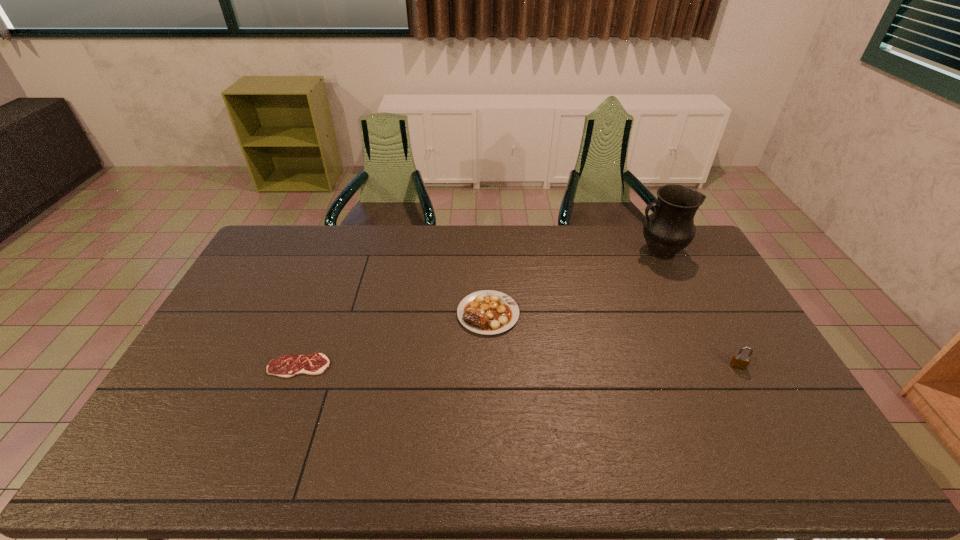
Locate an element on the screen. Image resolution: width=960 pixels, height=540 pixels. object that is the third closest to the leftmost object is located at coordinates (739, 361).

Identify which object is the closest to the second farthest object. Please provide its 2D coordinates. Your answer should be formatted as a tuple, i.e. [(x, y)], where the tuple contains the x and y coordinates of a point satisfying the conditions above.

[(286, 366)]

Find the location of a particular element. free space in the image that satisfies the following two spatial constraints: 1. on the handle side of the pitcher; 2. on the front side of the second farthest object is located at coordinates (690, 314).

The image size is (960, 540). Identify the location of free space that satisfies the following two spatial constraints: 1. on the back side of the leftmost object; 2. on the right side of the second tallest object. (300, 366).

Identify the location of free location that satisfies the following two spatial constraints: 1. on the back side of the farther steak; 2. on the left side of the nearer steak. The image size is (960, 540). (320, 314).

Image resolution: width=960 pixels, height=540 pixels. Identify the location of vacant space that satisfies the following two spatial constraints: 1. on the handle side of the tallest object; 2. on the front side of the third tallest object. (690, 314).